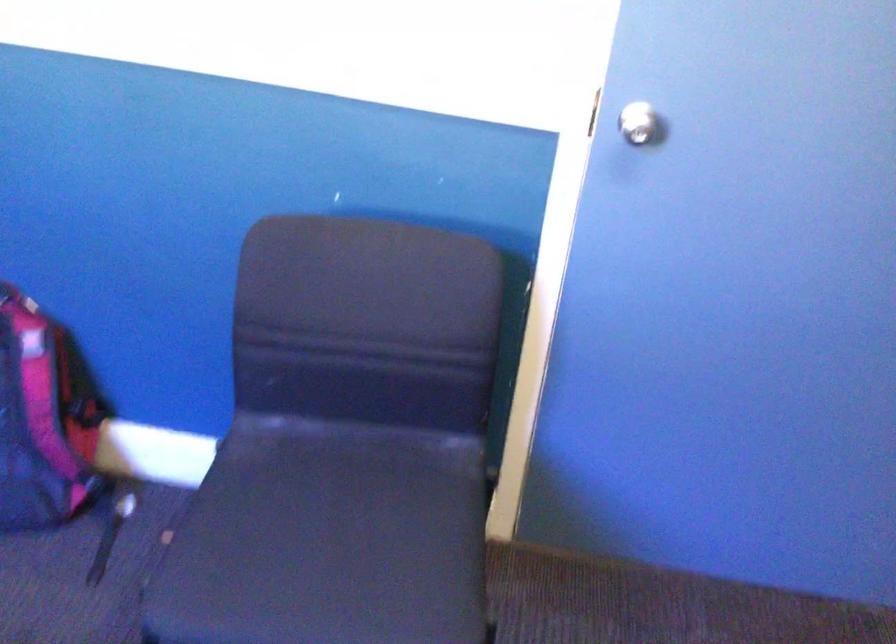
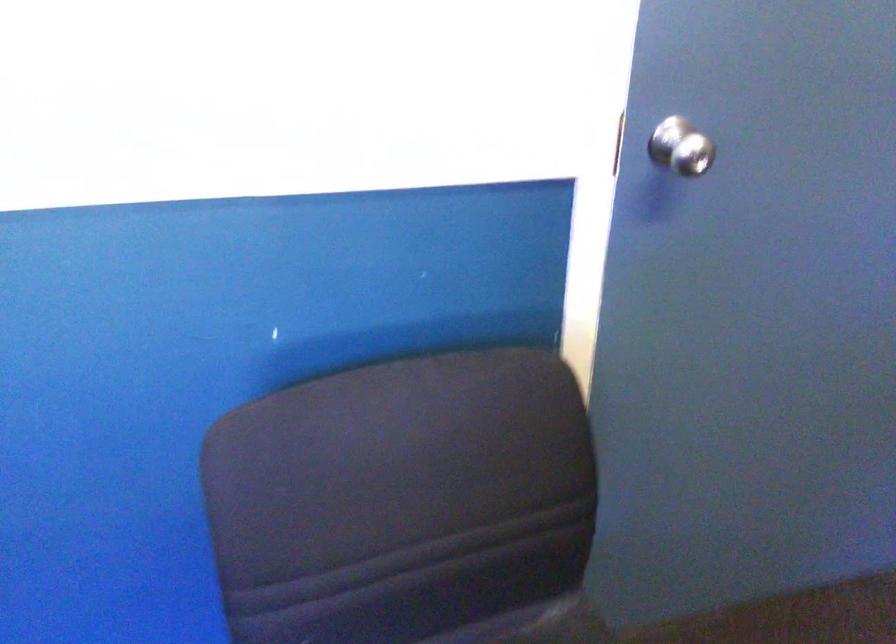
Question: The images are taken continuously from a first-person perspective. In which direction is your viewpoint rotating?

Choices:
 (A) Left
 (B) Right
 (C) Up
 (D) Down

Answer: (B)